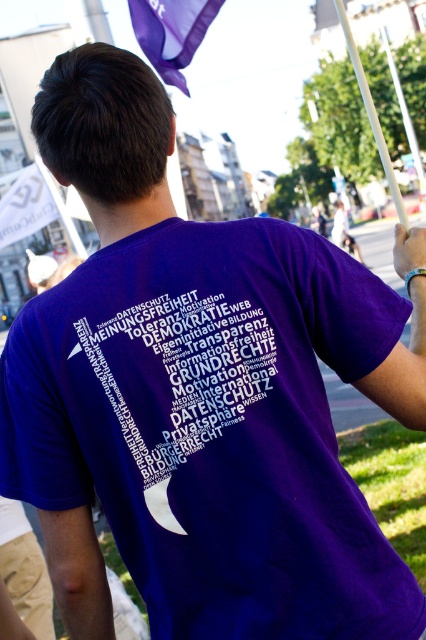
You are a tailor measuring fabrics for a customer. The customer wants to make a new flag using the same purple fabric as their shirt. Given the purple fabric shirt at back and the purple fabric flag at upper center, which object has a smaller width?

The purple fabric shirt at back has a smaller width than the purple fabric flag at upper center according to the description.

You are a photographer standing 6 feet away from the purple fabric shirt at back. You want to take a clear photo of the shirt without any blur. Considering the camera you have can focus up to 6 feet, will you be able to capture a sharp image?

The purple fabric shirt at back and camera are 6.42 feet apart. Since the camera can focus up to 6 feet, the distance is slightly beyond its focusing range, so the photo may come out blurry.

You are a photographer trying to capture a clear shot of the purple fabric flag at upper center. You notice the purple fabric shirt at back might block your view. Based on their sizes, can you determine if the shirt will obscure the flag?

The purple fabric shirt at back is not as tall as the purple fabric flag at upper center, so the shirt will not completely obscure the flag since it is shorter in height.